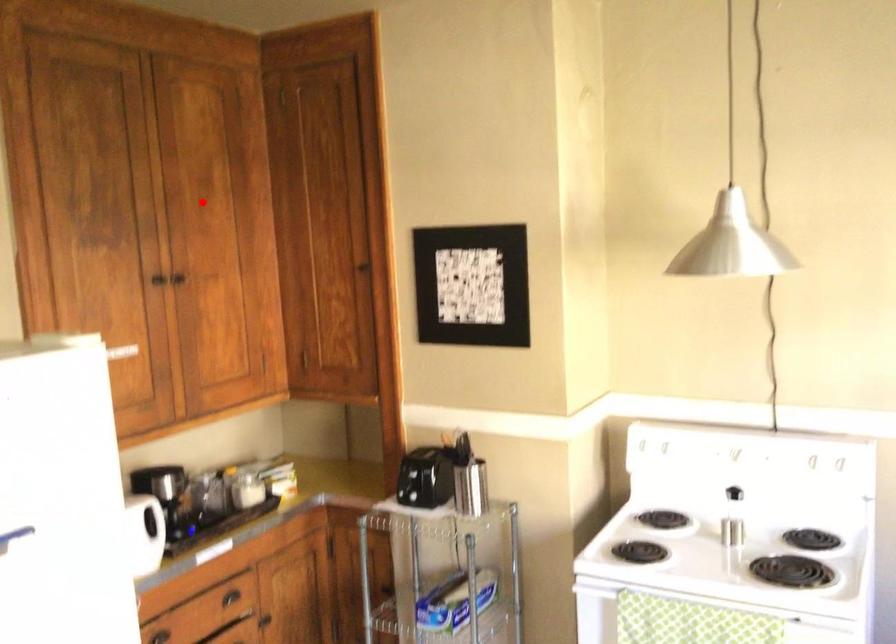
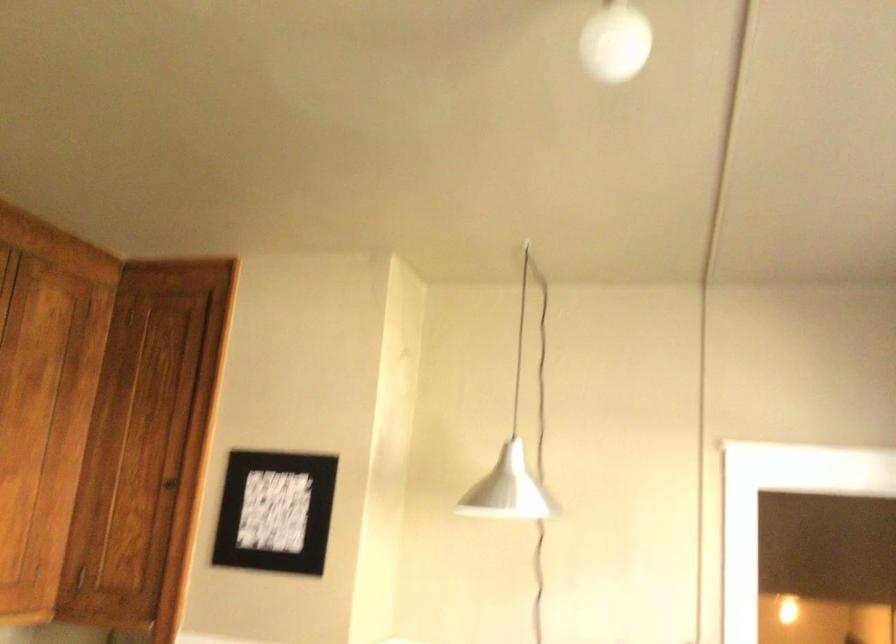
Find the pixel in the second image that matches the highlighted location in the first image.

(23, 397)